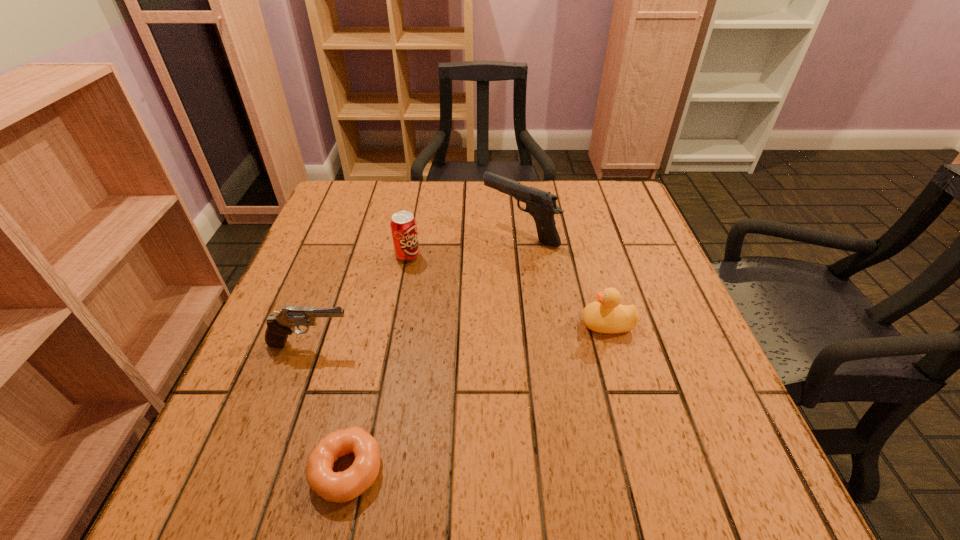
Where is `object that is at the right edge`? object that is at the right edge is located at coordinates (606, 315).

Image resolution: width=960 pixels, height=540 pixels. I want to click on free spot at the far edge of the desktop, so click(x=429, y=205).

Where is `vacant space at the near edge of the desktop`? vacant space at the near edge of the desktop is located at coordinates (339, 464).

Locate an element on the screen. The width and height of the screenshot is (960, 540). vacant space at the left edge of the desktop is located at coordinates (278, 310).

At what (x,y) coordinates should I click in order to perform the action: click on free space at the far left corner. Please return your answer as a coordinate pair (x, y). Image resolution: width=960 pixels, height=540 pixels. Looking at the image, I should click on (354, 205).

Where is `free location at the far right corner of the desktop`? free location at the far right corner of the desktop is located at coordinates (584, 189).

Find the location of `free space between the second nearest object and the duck`. free space between the second nearest object and the duck is located at coordinates (459, 334).

At what (x,y) coordinates should I click in order to perform the action: click on vacant space in between the second nearest object and the soda. Please return your answer as a coordinate pair (x, y). Image resolution: width=960 pixels, height=540 pixels. Looking at the image, I should click on (359, 300).

Locate an element on the screen. This screenshot has height=540, width=960. free spot between the shortest object and the fourth object from left to right is located at coordinates (434, 351).

Where is `unoccupied position between the gun and the rightmost object`? The width and height of the screenshot is (960, 540). unoccupied position between the gun and the rightmost object is located at coordinates coord(564,278).